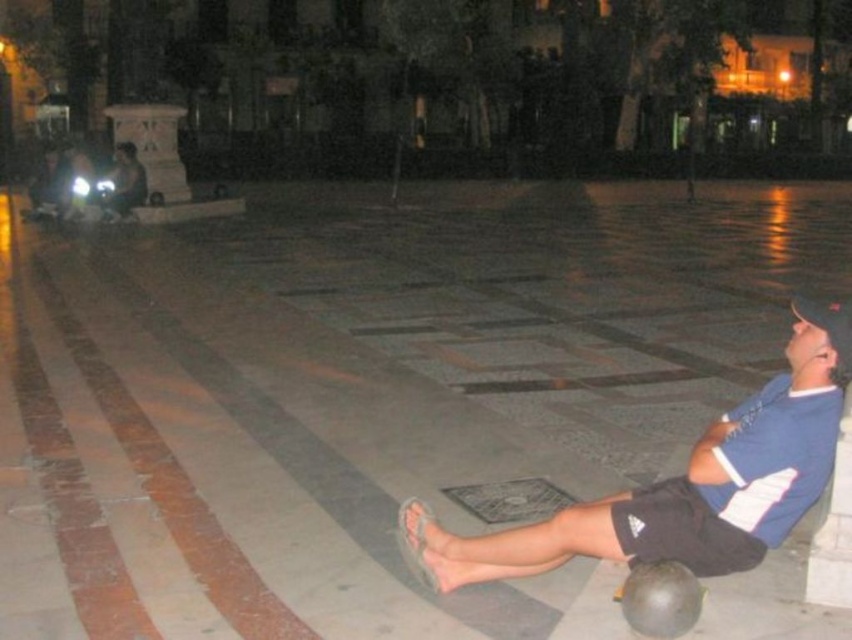
Is gray concrete pavement at center smaller than blue cotton shirt at center?

No.

Between point (649, 358) and point (820, 364), which one is positioned in front?

Point (820, 364)

Who is more forward, (22, 486) or (533, 538)?

Point (533, 538) is more forward.

The image size is (852, 640). In order to click on gray concrete pavement at center in this screenshot , I will do `click(367, 394)`.